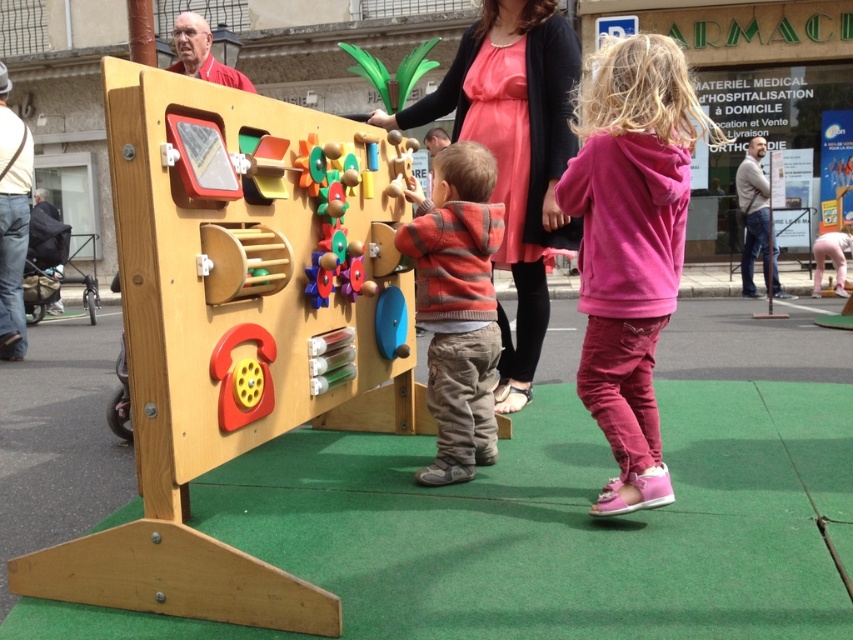
Which is behind, point (534, 310) or point (416, 480)?

The point (534, 310) is behind.

Can you confirm if matte pink dress at center is positioned below striped sweater at center?

Actually, matte pink dress at center is above striped sweater at center.

Is point (564, 88) closer to viewer compared to point (454, 419)?

No, (564, 88) is further to viewer.

At what (x,y) coordinates should I click in order to perform the action: click on matte pink dress at center. Please return your answer as a coordinate pair (x, y). Looking at the image, I should click on (x=515, y=154).

Is pink fleece hoodie at right smaller than striped sweater at center?

Actually, pink fleece hoodie at right might be larger than striped sweater at center.

Looking at this image, is pink fleece hoodie at right behind striped sweater at center?

No, it is in front of striped sweater at center.

You are a GUI agent. You are given a task and a screenshot of the screen. Output one action in this format:
    pyautogui.click(x=<x>, y=<y>)
    Task: Click on the pink fleece hoodie at right
    This screenshot has width=853, height=640.
    Given the screenshot: What is the action you would take?
    pyautogui.click(x=630, y=244)

Find the location of a particular element. This screenshot has height=640, width=853. pink fleece hoodie at right is located at coordinates (630, 244).

Is pink fleece hoodie at right closer to camera compared to matte pink dress at center?

Yes, pink fleece hoodie at right is in front of matte pink dress at center.

Can you confirm if pink fleece hoodie at right is positioned to the left of matte pink dress at center?

No, pink fleece hoodie at right is not to the left of matte pink dress at center.

What are the coordinates of `pink fleece hoodie at right` in the screenshot? It's located at (630, 244).

The width and height of the screenshot is (853, 640). In order to click on pink fleece hoodie at right in this screenshot , I will do `click(630, 244)`.